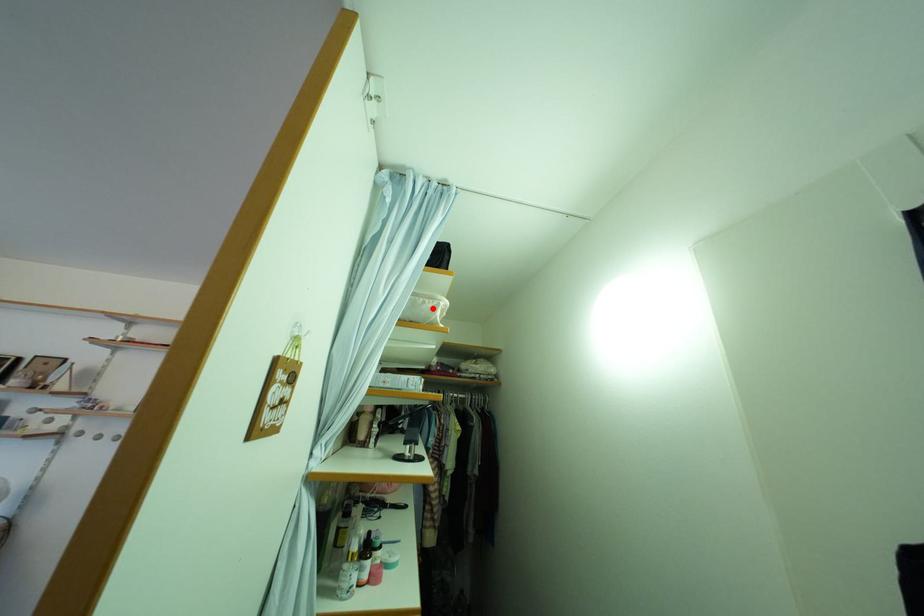
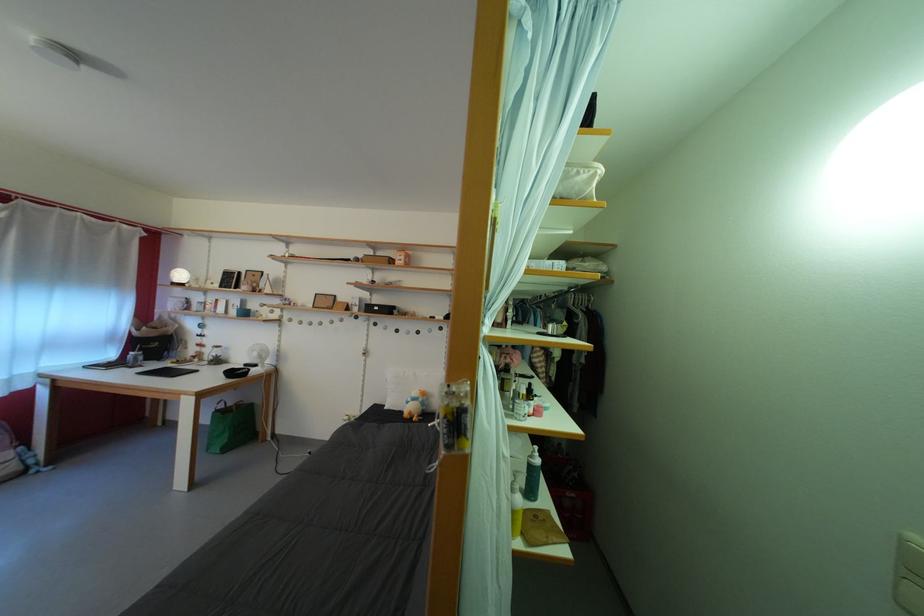
The point at the highlighted location is marked in the first image. Where is the corresponding point in the second image?

(587, 179)